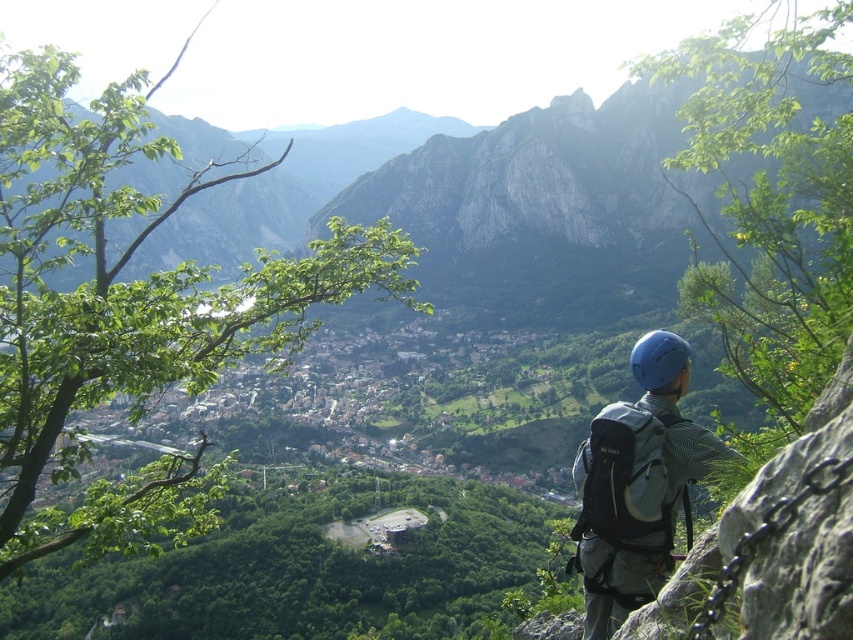
Question: Which point is farther to the camera?

Choices:
 (A) (621, 428)
 (B) (666, 358)

Answer: (B)

Question: Which of the following is the closest to the observer?

Choices:
 (A) (675, 349)
 (B) (616, 609)

Answer: (B)

Question: Does matte gray backpack at center right appear on the right side of blue matte helmet at center?

Choices:
 (A) yes
 (B) no

Answer: (B)

Question: Does matte gray backpack at center right have a lesser width compared to blue matte helmet at center?

Choices:
 (A) no
 (B) yes

Answer: (A)

Question: Which of the following is the closest to the observer?

Choices:
 (A) blue matte helmet at center
 (B) matte gray backpack at center right

Answer: (B)

Question: Can you confirm if matte gray backpack at center right is bigger than blue matte helmet at center?

Choices:
 (A) yes
 (B) no

Answer: (A)